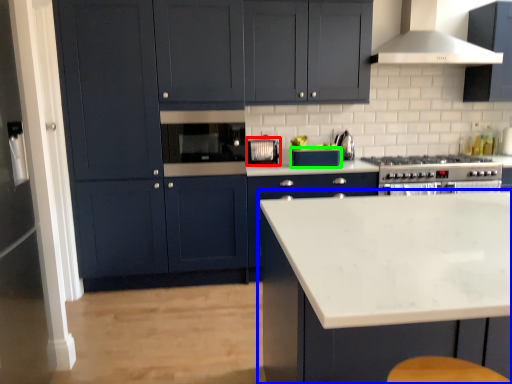
Question: Based on their relative distances, which object is nearer to appliance (highlighted by a red box)? Choose from cabinetry (highlighted by a blue box) and appliance (highlighted by a green box).

Choices:
 (A) cabinetry
 (B) appliance

Answer: (B)